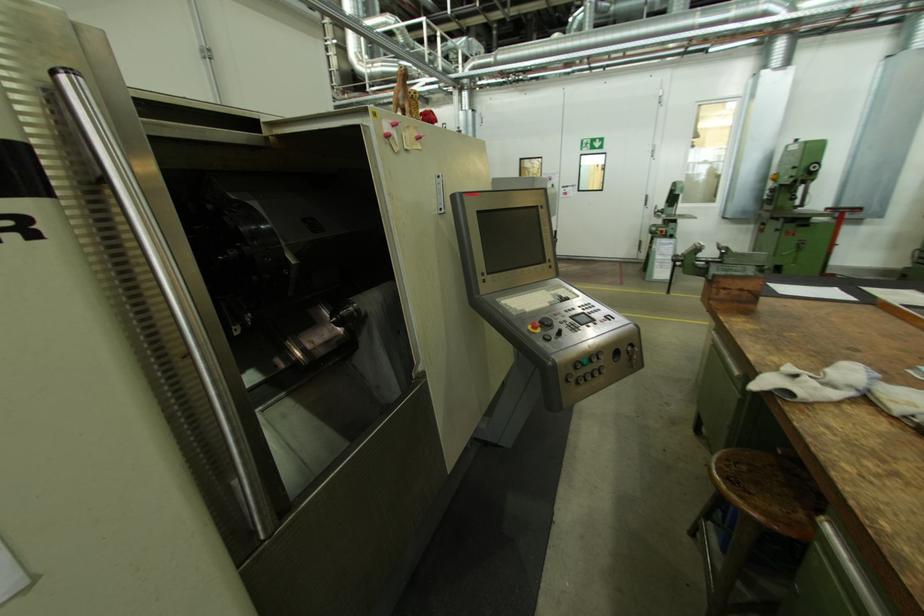
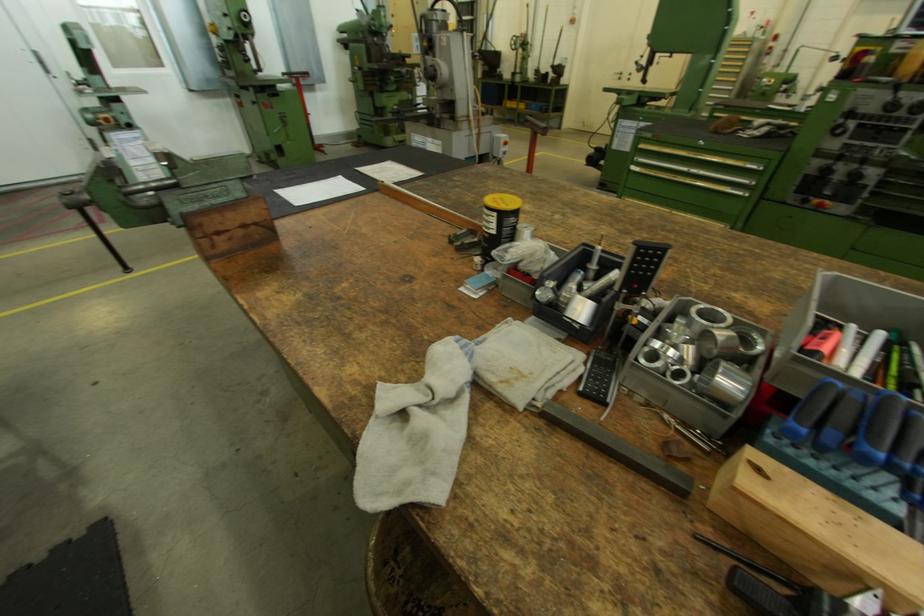
Where in the second image is the point corresponding to pixel 849 206 from the first image?

(299, 71)